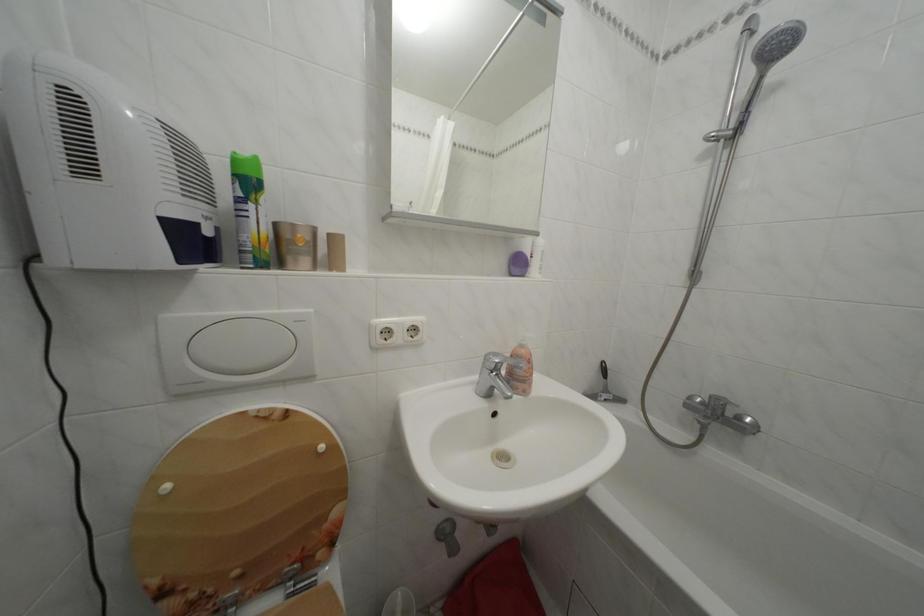
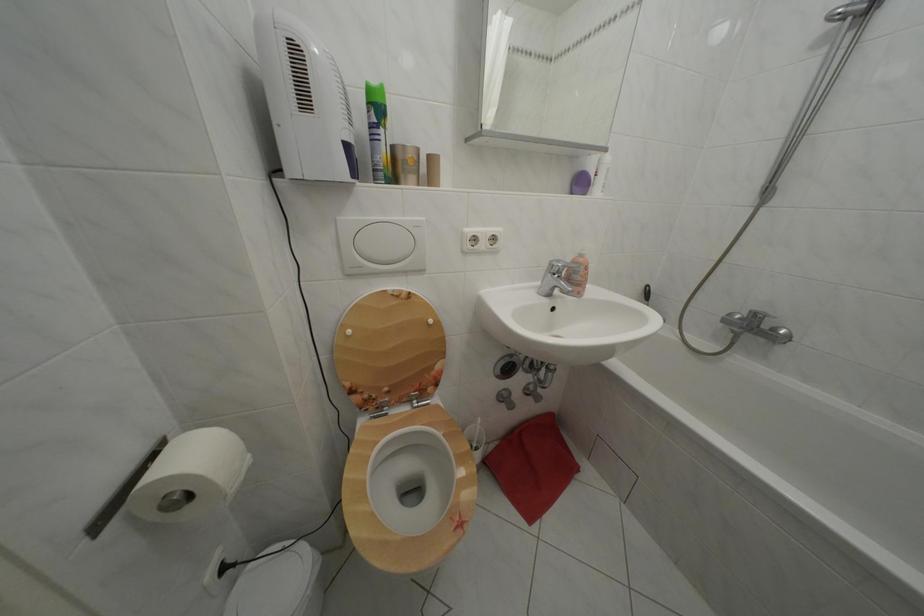
Where in the second image is the point corresponding to the point at 176,493 from the first image?

(358, 338)